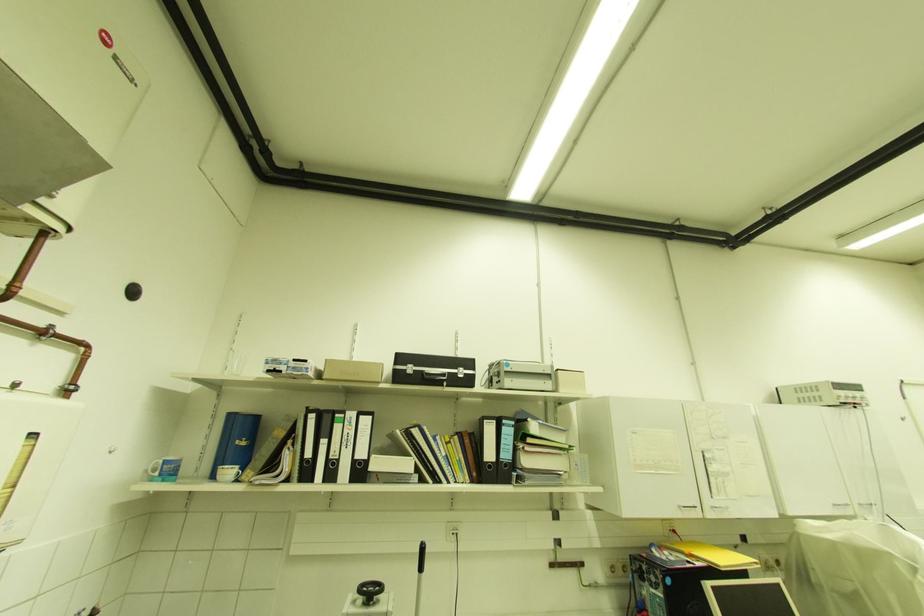
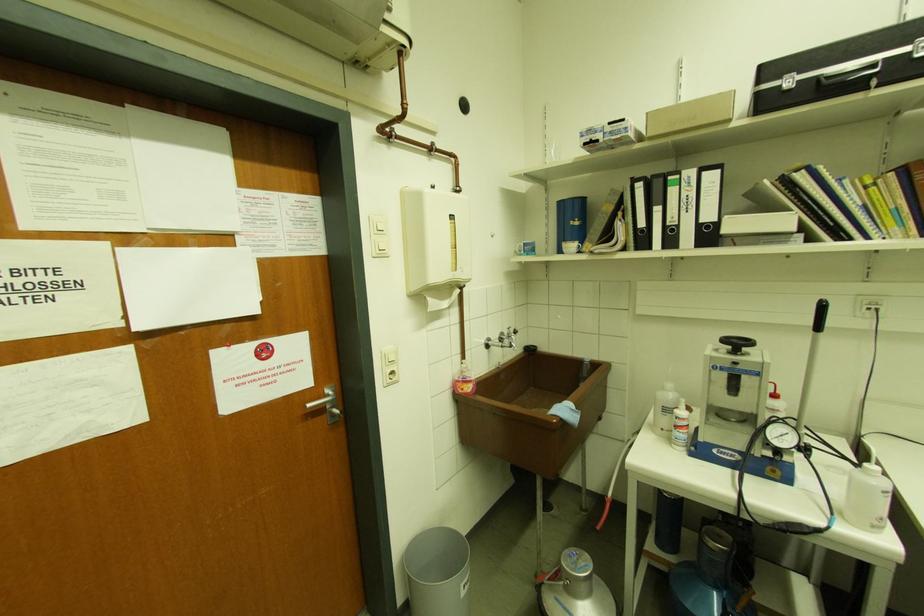
Find the pixel in the second image that matches (365,456) in the first image.

(712, 217)